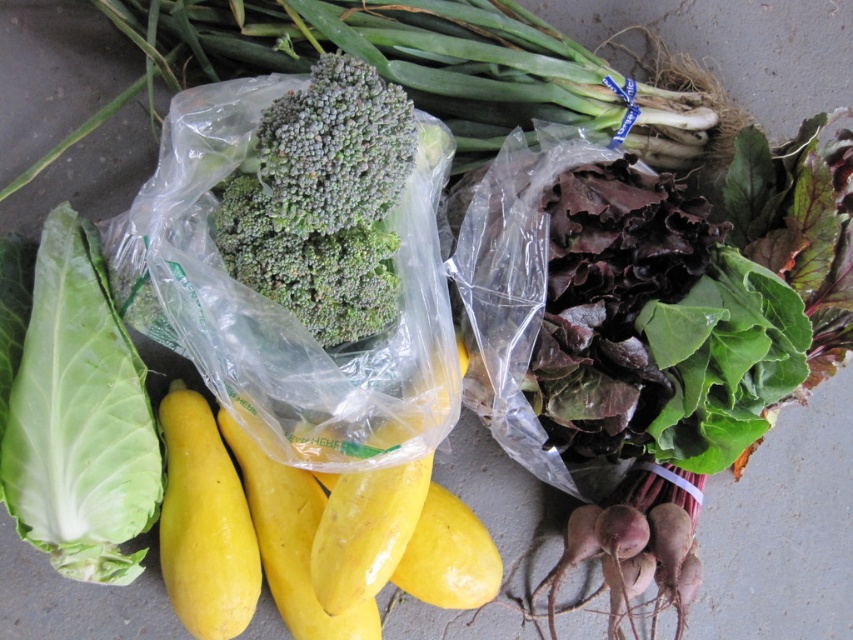
Question: Estimate the real-world distances between objects in this image. Which object is closer to the green leafy at left?

Choices:
 (A) yellow matte squash at center
 (B) yellow smooth squash at lower left

Answer: (B)

Question: Considering the relative positions of green leafy at left and green matte broccoli at center in the image provided, where is green leafy at left located with respect to green matte broccoli at center?

Choices:
 (A) left
 (B) right

Answer: (A)

Question: Is green leafy at left smaller than yellow smooth squash at lower left?

Choices:
 (A) yes
 (B) no

Answer: (B)

Question: Which of these objects is positioned closest to the green matte broccoli at center?

Choices:
 (A) green leafy at left
 (B) yellow smooth squash at lower left

Answer: (A)

Question: Which of these objects is positioned closest to the green leafy at left?

Choices:
 (A) yellow matte squash at center
 (B) yellow smooth squash at lower left
 (C) green matte broccoli at center

Answer: (B)

Question: Can you confirm if green matte broccoli at center is smaller than yellow matte squash at center?

Choices:
 (A) no
 (B) yes

Answer: (A)